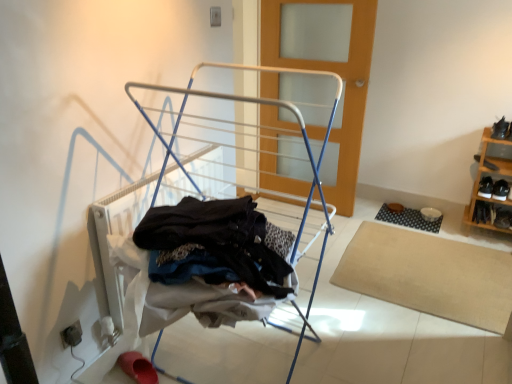
Locate an element on the screen. free location to the left of black rubber mat at lower right, which is counted as the 1th mat, starting from the back is located at coordinates (369, 216).